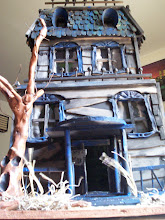
Where is `wall`? The image size is (165, 220). wall is located at coordinates (3, 140), (148, 71).